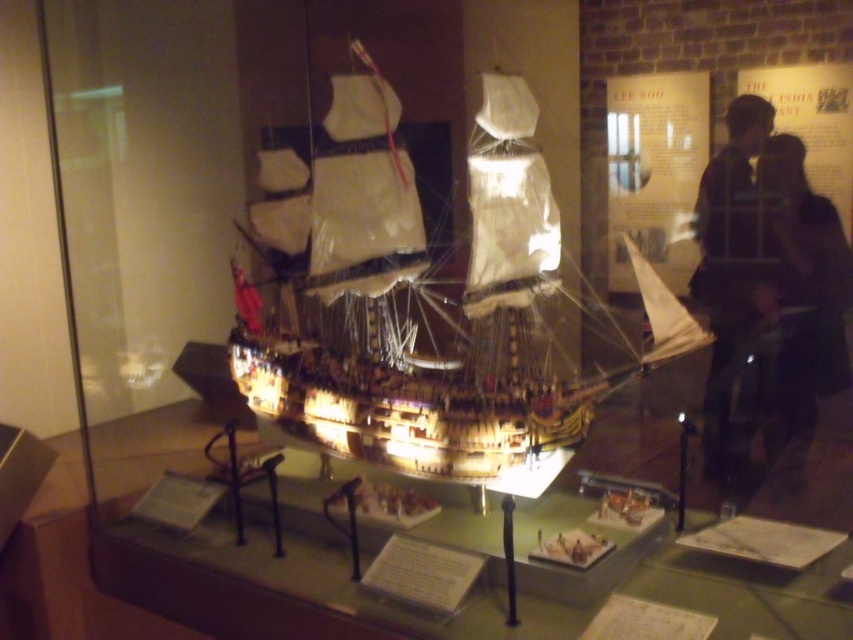
Question: Among these points, which one is farthest from the camera?

Choices:
 (A) (773, 436)
 (B) (729, 323)

Answer: (B)

Question: Is dark fabric jacket at right below dark brown leather jacket at right?

Choices:
 (A) yes
 (B) no

Answer: (A)

Question: Among these objects, which one is nearest to the camera?

Choices:
 (A) wooden ship at center
 (B) dark brown leather jacket at right
 (C) dark fabric jacket at right

Answer: (A)

Question: Does wooden ship at center appear on the right side of dark brown leather jacket at right?

Choices:
 (A) no
 (B) yes

Answer: (A)

Question: Is wooden ship at center bigger than dark brown leather jacket at right?

Choices:
 (A) no
 (B) yes

Answer: (B)

Question: Which point is closer to the camera?

Choices:
 (A) dark brown leather jacket at right
 (B) dark fabric jacket at right

Answer: (B)